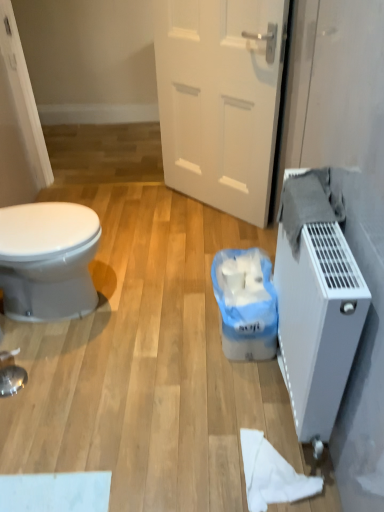
Question: Does white matte door at center have a smaller size compared to white matte toilet paper at lower right?

Choices:
 (A) no
 (B) yes

Answer: (A)

Question: From a real-world perspective, is white matte door at center on top of white matte toilet paper at lower right?

Choices:
 (A) yes
 (B) no

Answer: (A)

Question: Is white matte door at center oriented away from white matte toilet paper at lower right?

Choices:
 (A) yes
 (B) no

Answer: (B)

Question: Would you say white matte door at center contains white matte toilet paper at lower right?

Choices:
 (A) no
 (B) yes

Answer: (A)

Question: Is white matte door at center completely or partially outside of white matte toilet paper at lower right?

Choices:
 (A) yes
 (B) no

Answer: (A)

Question: In terms of size, does white matte toilet paper at lower right appear bigger or smaller than white plastic radiator at right?

Choices:
 (A) big
 (B) small

Answer: (B)

Question: From the image's perspective, relative to white plastic radiator at right, is white matte toilet paper at lower right above or below?

Choices:
 (A) above
 (B) below

Answer: (B)

Question: Is white matte toilet paper at lower right spatially inside white plastic radiator at right, or outside of it?

Choices:
 (A) outside
 (B) inside

Answer: (A)

Question: Visually, is white matte toilet paper at lower right positioned to the left or to the right of white plastic radiator at right?

Choices:
 (A) left
 (B) right

Answer: (A)

Question: Is white plastic radiator at right bigger or smaller than white matte toilet paper at lower right?

Choices:
 (A) big
 (B) small

Answer: (A)

Question: From a real-world perspective, is white plastic radiator at right physically located above or below white matte toilet paper at lower right?

Choices:
 (A) above
 (B) below

Answer: (A)

Question: Is white plastic radiator at right situated inside white matte toilet paper at lower right or outside?

Choices:
 (A) outside
 (B) inside

Answer: (A)

Question: Considering the positions of white plastic radiator at right and white matte toilet paper at lower right in the image, is white plastic radiator at right taller or shorter than white matte toilet paper at lower right?

Choices:
 (A) short
 (B) tall

Answer: (B)

Question: From a real-world perspective, is white plastic bag at lower center physically located above or below white plastic radiator at right?

Choices:
 (A) below
 (B) above

Answer: (A)

Question: Looking at their shapes, would you say white plastic bag at lower center is wider or thinner than white plastic radiator at right?

Choices:
 (A) wide
 (B) thin

Answer: (A)